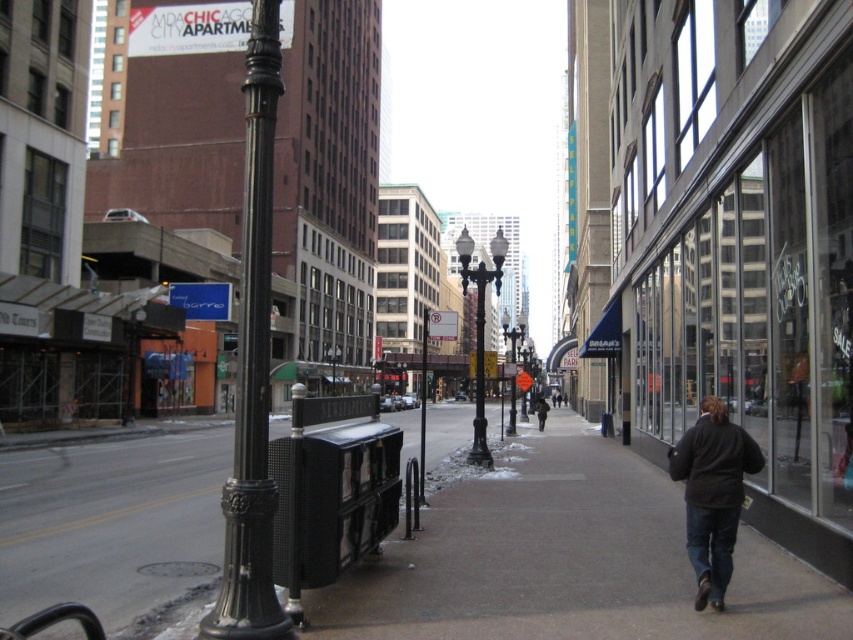
Can you confirm if dark brown jacket at lower right is positioned to the left of black metal streetlight at center?

Indeed, dark brown jacket at lower right is positioned on the left side of black metal streetlight at center.

Does point (718, 552) come behind point (529, 365)?

No, it is in front of (529, 365).

Locate an element on the screen. dark brown jacket at lower right is located at coordinates (712, 493).

Between dark brown jacket at lower right and black polished metal streetlight at center, which one has less height?

dark brown jacket at lower right

Does dark brown jacket at lower right have a greater height compared to black polished metal streetlight at center?

No, dark brown jacket at lower right is not taller than black polished metal streetlight at center.

The image size is (853, 640). What do you see at coordinates (712, 493) in the screenshot?
I see `dark brown jacket at lower right` at bounding box center [712, 493].

You are a GUI agent. You are given a task and a screenshot of the screen. Output one action in this format:
    pyautogui.click(x=<x>, y=<y>)
    Task: Click on the dark brown jacket at lower right
    This screenshot has height=640, width=853.
    Given the screenshot: What is the action you would take?
    pyautogui.click(x=712, y=493)

Looking at this image, does black metal streetlight at center appear on the left side of brown fuzzy coat at center?

In fact, black metal streetlight at center is to the right of brown fuzzy coat at center.

Does black metal streetlight at center have a greater height compared to brown fuzzy coat at center?

Correct, black metal streetlight at center is much taller as brown fuzzy coat at center.

The width and height of the screenshot is (853, 640). I want to click on black metal streetlight at center, so click(x=525, y=353).